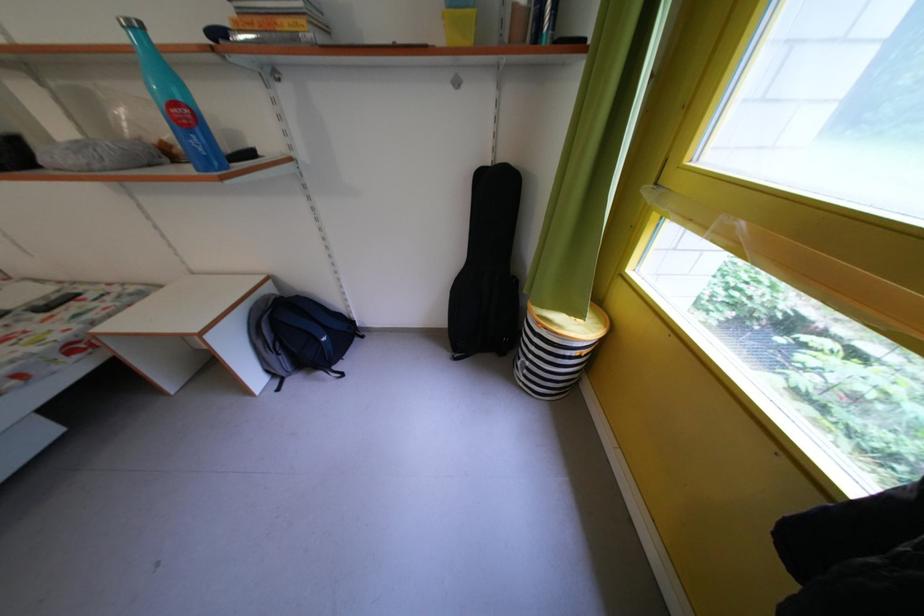
Find where to lift the striped laundry hamper. Please return your answer as a coordinate pair (x, y).

(555, 350)